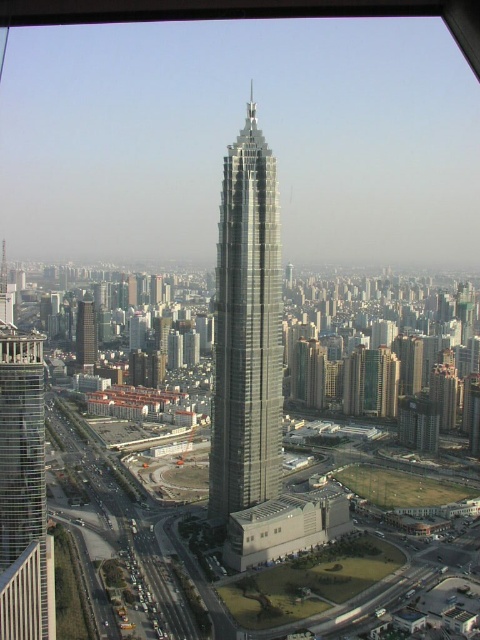
Is silver glass skyscraper at center thinner than glassy silver skyscraper at left?

Incorrect, silver glass skyscraper at center's width is not less than glassy silver skyscraper at left's.

Describe the element at coordinates (247, 330) in the screenshot. I see `silver glass skyscraper at center` at that location.

Identify the location of silver glass skyscraper at center. (247, 330).

Between glassy silver skyscraper at left and smooth glass skyscraper at center, which one is positioned lower?

glassy silver skyscraper at left

Looking at this image, can you confirm if glassy silver skyscraper at left is smaller than smooth glass skyscraper at center?

Yes.

This screenshot has width=480, height=640. I want to click on glassy silver skyscraper at left, so click(24, 472).

Identify the location of glassy silver skyscraper at left. The width and height of the screenshot is (480, 640). (24, 472).

Can you confirm if smooth glass skyscraper at center is wider than transparent glass window at center?

Correct, the width of smooth glass skyscraper at center exceeds that of transparent glass window at center.

Between point (93, 316) and point (260, 534), which one is positioned in front?

Point (260, 534) is in front.

Consider the image. Measure the distance between point [84,337] and camera.

1729.37 feet

At what (x,y) coordinates should I click in order to perform the action: click on smooth glass skyscraper at center. Please return your answer as a coordinate pair (x, y). This screenshot has height=640, width=480. Looking at the image, I should click on point(85,333).